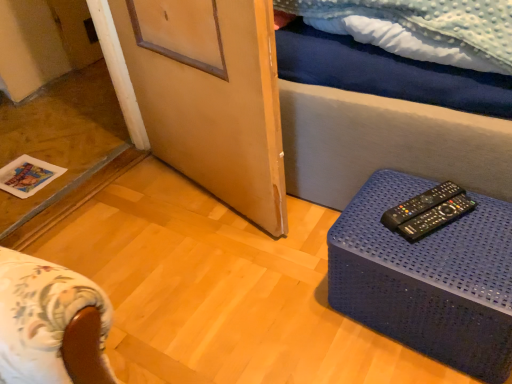
Where is `free space above blue plastic table at lower right (from a real-world perspective)`? The width and height of the screenshot is (512, 384). free space above blue plastic table at lower right (from a real-world perspective) is located at coordinates (437, 228).